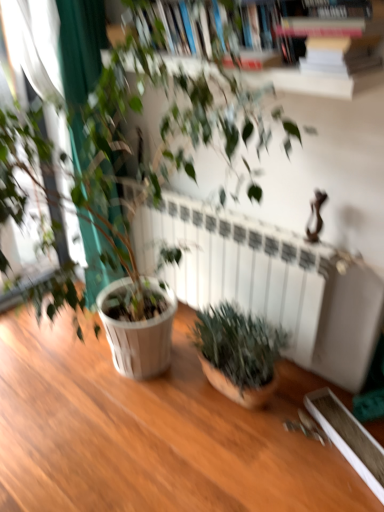
Where is `vacant region in front of green matte plant at lower right, the second houseplant from the top`? This screenshot has width=384, height=512. vacant region in front of green matte plant at lower right, the second houseplant from the top is located at coordinates (237, 452).